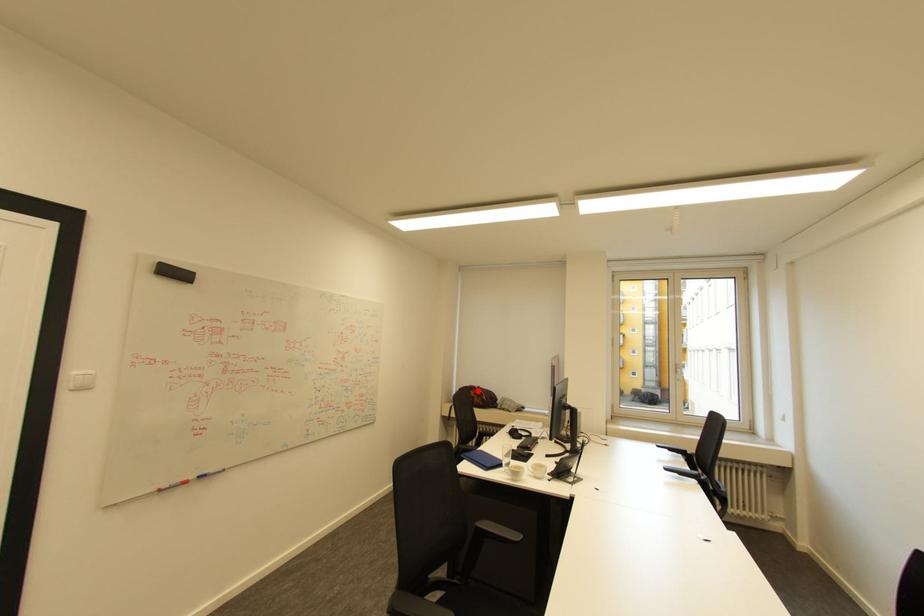
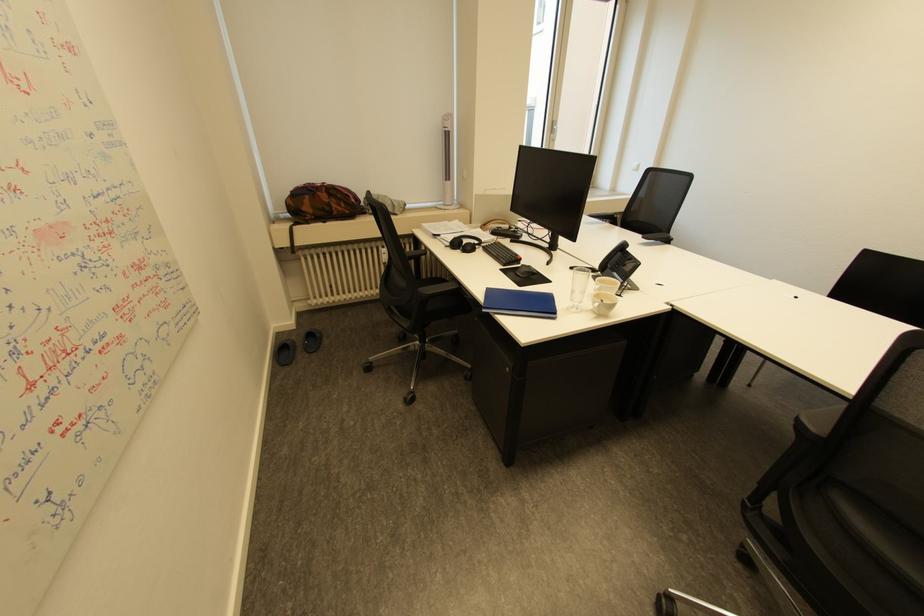
Question: I am providing you with two images of the same scene from different viewpoints. A red point is shown in image1. For the corresponding object point in image2, is it positioned nearer or farther from the camera?

Choices:
 (A) Nearer
 (B) Farther

Answer: (A)